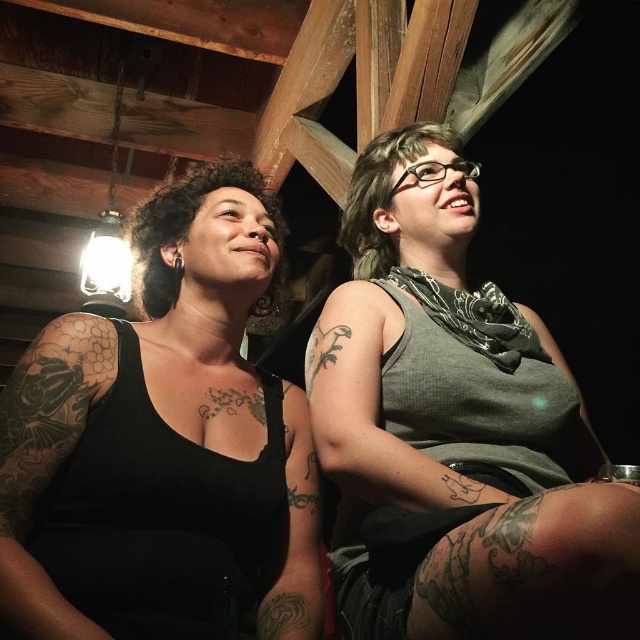
Question: Which is farther from the black matte tank top at left?

Choices:
 (A) black tattooed arm at left
 (B) gray matte tank top at center

Answer: (B)

Question: Which point is farther to the camera?

Choices:
 (A) (170, 310)
 (B) (74, 326)
 (C) (483, 397)

Answer: (A)

Question: Which point appears closest to the camera in this image?

Choices:
 (A) (280, 566)
 (B) (452, 513)

Answer: (B)

Question: Does black matte tank top at left have a smaller size compared to black tattooed arm at left?

Choices:
 (A) yes
 (B) no

Answer: (B)

Question: Is gray matte tank top at center further to camera compared to black matte tank top at left?

Choices:
 (A) yes
 (B) no

Answer: (B)

Question: Can you confirm if gray matte tank top at center is positioned above black tattooed arm at left?

Choices:
 (A) yes
 (B) no

Answer: (A)